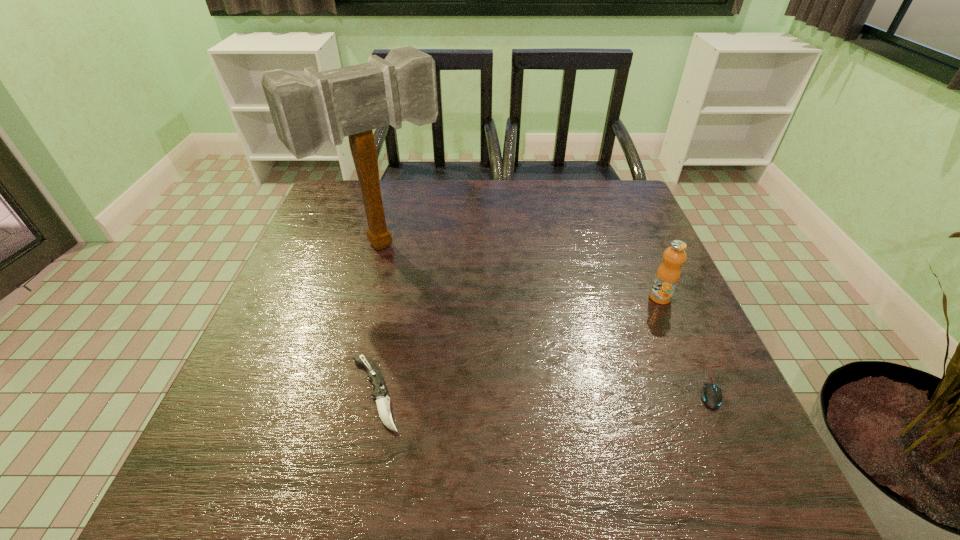
Where is `vacant space on the desktop that is between the pocketknife and the mouse and is positioned on the front label of the third nearest object`? vacant space on the desktop that is between the pocketknife and the mouse and is positioned on the front label of the third nearest object is located at coordinates (511, 389).

The height and width of the screenshot is (540, 960). I want to click on free spot on the desktop that is between the pocketknife and the mouse and is positioned at the head of the mallet, so click(x=512, y=389).